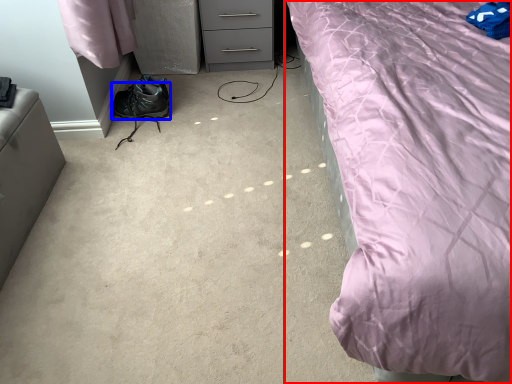
Question: Which object is closer to the camera taking this photo, bed (highlighted by a red box) or shoe (highlighted by a blue box)?

Choices:
 (A) bed
 (B) shoe

Answer: (A)